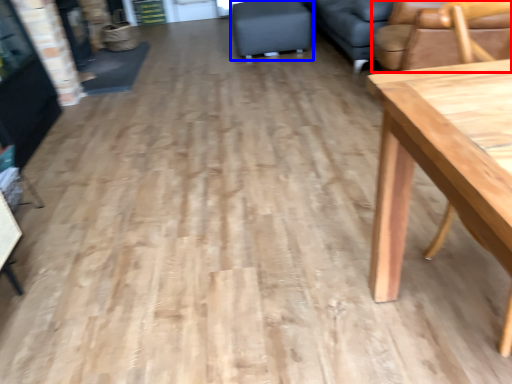
Question: Which object appears farthest to the camera in this image, chair (highlighted by a red box) or swivel chair (highlighted by a blue box)?

Choices:
 (A) chair
 (B) swivel chair

Answer: (B)